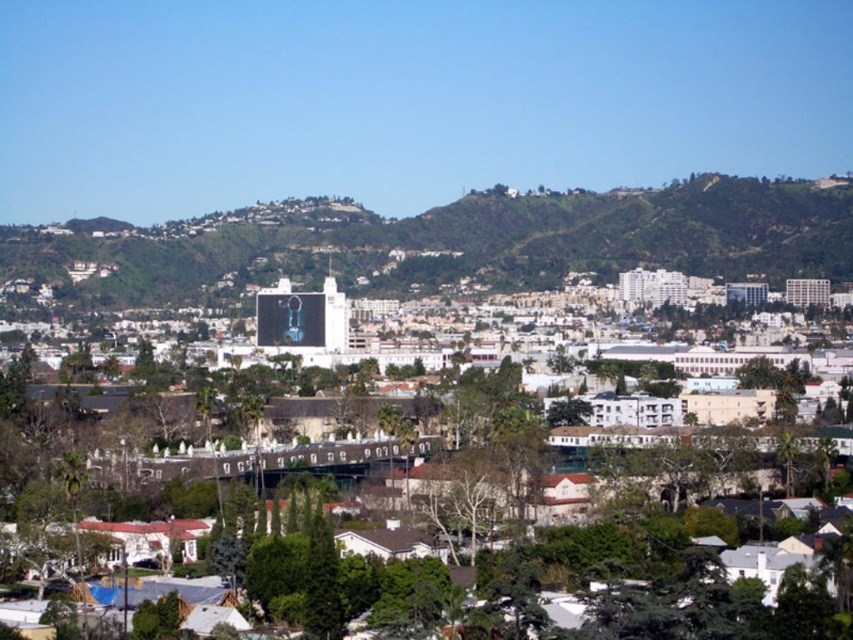
You are a drone operator flying a drone over the suburban area. You need to land your drone on the green grassy hill at center. However, there is a green leafy tree at center in the way. Can the drone safely land on the hill without hitting the tree?

The green grassy hill at center is smaller than the green leafy tree at center, so the tree is larger and might obstruct the landing area. The drone may not have enough space to land safely on the hill without hitting the tree.

You are planning to install a new garden bench in the suburban area shown. The bench requires at least 70 meters of space between the green grassy hill at center and the green leafy tree at center for proper placement. Based on the image, will there be enough space?

The green grassy hill at center and green leafy tree at center are 68.47 meters apart, which is less than the required 70 meters. Therefore, there is insufficient space for the garden bench.

You are standing in the suburban area and want to take a photo of the green leafy tree at center and the green grassy hill at center. Which object should you frame first in your camera to ensure both are in the shot?

You should frame the green leafy tree at center first because the green grassy hill at center is to the right of it, so positioning the tree first ensures the hill will be included to its right.